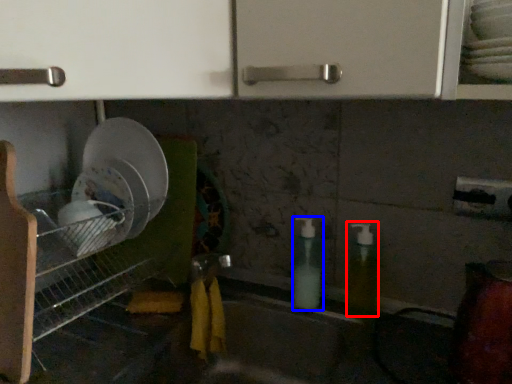
Question: Which of the following is the closest to the observer, soap dispenser (highlighted by a red box) or soap dispenser (highlighted by a blue box)?

Choices:
 (A) soap dispenser
 (B) soap dispenser

Answer: (A)